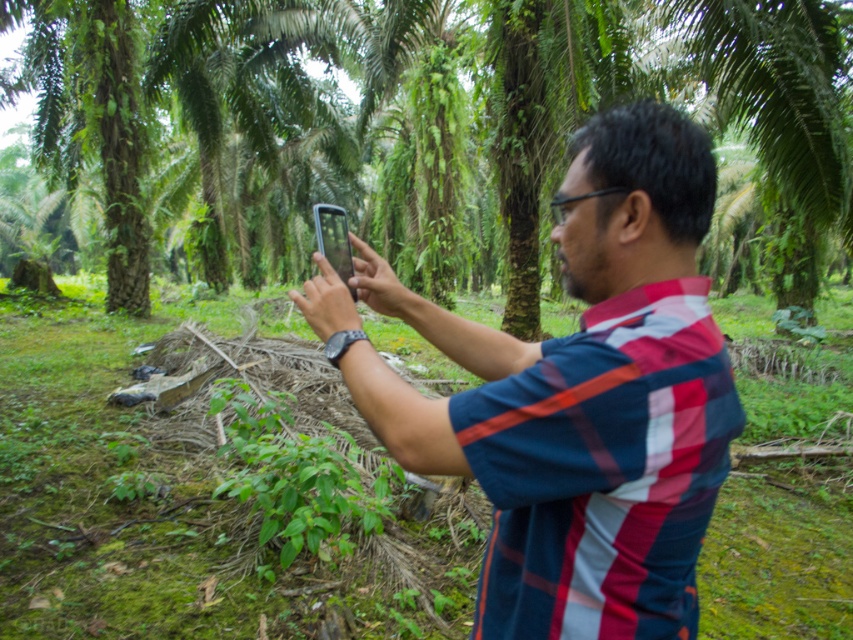
Based on the photo, based on the scene description, where is the green leafy tree at center located in terms of coordinates?

The green leafy tree at center is located at point coordinates of (425, 129).